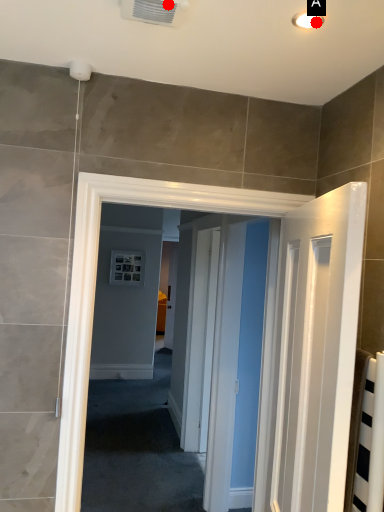
Question: Two points are circled on the image, labeled by A and B beside each circle. Which point is closer to the camera taking this photo?

Choices:
 (A) A is closer
 (B) B is closer

Answer: (B)